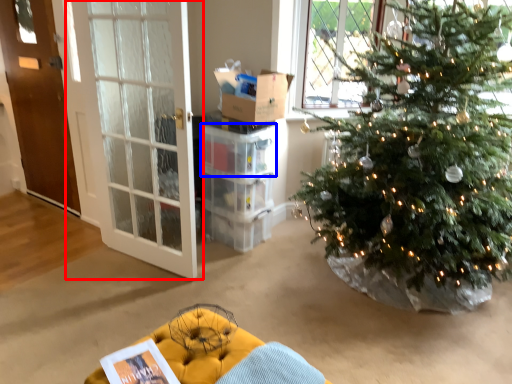
Question: Which object appears closest to the camera in this image, door (highlighted by a red box) or crate (highlighted by a blue box)?

Choices:
 (A) door
 (B) crate

Answer: (A)